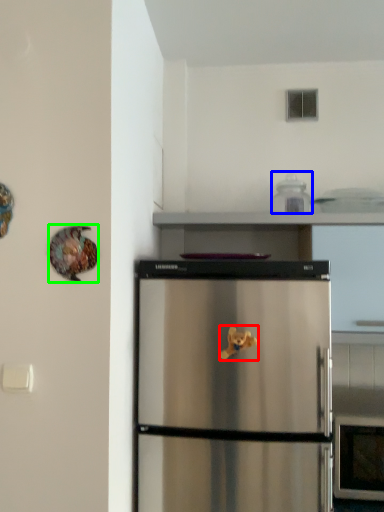
Question: Considering the real-world distances, which object is farthest from toy (highlighted by a red box)? appliance (highlighted by a blue box) or animal (highlighted by a green box)?

Choices:
 (A) appliance
 (B) animal

Answer: (A)